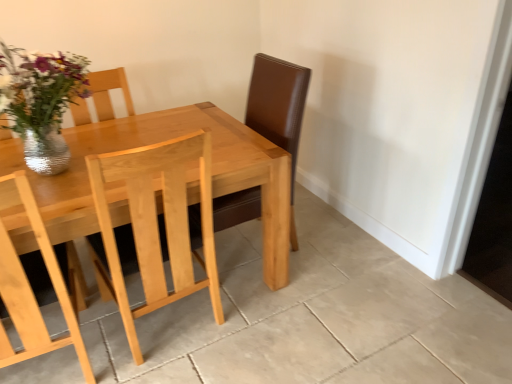
Find the location of a particular element. metallic silver vase at upper left is located at coordinates [x=41, y=102].

Locate an element on the screen. The image size is (512, 384). light wood table at center is located at coordinates pyautogui.click(x=162, y=141).

Is metallic silver vase at upper left touching light wood chair at center?

There is a gap between metallic silver vase at upper left and light wood chair at center.

From the image's perspective, relative to light wood chair at center, is metallic silver vase at upper left above or below?

metallic silver vase at upper left is situated higher than light wood chair at center in the image.

How many degrees apart are the facing directions of metallic silver vase at upper left and light wood chair at center?

The angle between the facing direction of metallic silver vase at upper left and the facing direction of light wood chair at center is 180 degrees.

I want to click on chair below the metallic silver vase at upper left (from the image's perspective), so click(x=157, y=223).

Which is more to the right, light wood table at center or light wood chair at center?

Positioned to the right is light wood chair at center.

How different are the orientations of light wood table at center and light wood chair at center in degrees?

The angular difference between light wood table at center and light wood chair at center is 180 degrees.

Which point is more distant from viewer, (79, 210) or (151, 246)?

Point (151, 246)

Considering the relative positions of light wood table at center and light wood chair at center in the image provided, is light wood table at center in front of light wood chair at center?

Yes.

From the image's perspective, is light wood chair at center beneath metallic silver vase at upper left?

Indeed, from the image's perspective, light wood chair at center is shown beneath metallic silver vase at upper left.

Does light wood chair at center come in front of metallic silver vase at upper left?

Yes, light wood chair at center is in front of metallic silver vase at upper left.

Is point (159, 148) positioned in front of point (28, 100)?

Yes, point (159, 148) is in front of point (28, 100).

Is metallic silver vase at upper left located within light wood chair at center?

Actually, metallic silver vase at upper left is outside light wood chair at center.

Looking at this image, who is taller, metallic silver vase at upper left or light wood table at center?

With more height is light wood table at center.

Considering the positions of objects metallic silver vase at upper left and light wood table at center in the image provided, who is behind, metallic silver vase at upper left or light wood table at center?

metallic silver vase at upper left is more distant.

Between metallic silver vase at upper left and light wood table at center, which one has smaller width?

metallic silver vase at upper left.

Are metallic silver vase at upper left and light wood table at center beside each other?

No, metallic silver vase at upper left is not making contact with light wood table at center.

How distant is light wood table at center from metallic silver vase at upper left?

36.11 centimeters.

From the image's perspective, is light wood table at center under metallic silver vase at upper left?

Yes, from the image's perspective, light wood table at center is beneath metallic silver vase at upper left.

In order to click on kitchen & dining room table below the metallic silver vase at upper left (from a real-world perspective) in this screenshot , I will do `click(162, 141)`.

Which is more to the left, light wood table at center or metallic silver vase at upper left?

metallic silver vase at upper left.

Considering the sizes of light wood chair at center and light wood table at center in the image, is light wood chair at center bigger or smaller than light wood table at center?

light wood chair at center is smaller than light wood table at center.

Which is behind, light wood chair at center or light wood table at center?

light wood chair at center is further away from the camera.

From the image's perspective, is light wood chair at center positioned above or below light wood table at center?

Clearly, from the image's perspective, light wood chair at center is below light wood table at center.

This screenshot has height=384, width=512. Identify the location of kitchen & dining room table to the left of light wood chair at center. (162, 141).

In order to click on chair in front of the metallic silver vase at upper left in this screenshot , I will do `click(157, 223)`.

Locate an element on the screen. kitchen & dining room table above the light wood chair at center (from the image's perspective) is located at coordinates (162, 141).

When comparing their distances from metallic silver vase at upper left, does light wood table at center or light wood chair at center seem further?

light wood chair at center lies further to metallic silver vase at upper left than the other object.

Considering their positions, is light wood chair at center positioned closer to metallic silver vase at upper left than light wood table at center?

light wood table at center is closer to metallic silver vase at upper left.

Which object lies further to the anchor point light wood table at center, metallic silver vase at upper left or light wood chair at center?

metallic silver vase at upper left is positioned further to the anchor light wood table at center.

Looking at the image, which one is located further to light wood table at center, light wood chair at center or metallic silver vase at upper left?

Based on the image, metallic silver vase at upper left appears to be further to light wood table at center.

Considering their positions, is metallic silver vase at upper left positioned further to light wood chair at center than light wood table at center?

Among the two, metallic silver vase at upper left is located further to light wood chair at center.

Estimate the real-world distances between objects in this image. Which object is closer to light wood chair at center, light wood table at center or metallic silver vase at upper left?

light wood table at center.

Locate an element on the screen. This screenshot has height=384, width=512. kitchen & dining room table between metallic silver vase at upper left and light wood chair at center from top to bottom is located at coordinates (162, 141).